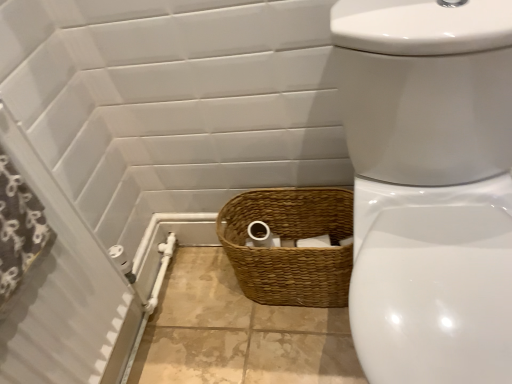
Question: From the image's perspective, is black fabric shower curtain at left on white glossy toilet at center?

Choices:
 (A) yes
 (B) no

Answer: (A)

Question: From a real-world perspective, is black fabric shower curtain at left located beneath white glossy toilet at center?

Choices:
 (A) no
 (B) yes

Answer: (A)

Question: Can white glossy toilet at center be found inside black fabric shower curtain at left?

Choices:
 (A) yes
 (B) no

Answer: (B)

Question: Considering the relative sizes of black fabric shower curtain at left and white glossy toilet at center in the image provided, is black fabric shower curtain at left smaller than white glossy toilet at center?

Choices:
 (A) no
 (B) yes

Answer: (B)

Question: Can you confirm if black fabric shower curtain at left is bigger than white glossy toilet at center?

Choices:
 (A) no
 (B) yes

Answer: (A)

Question: Is black fabric shower curtain at left in front of white glossy toilet at center?

Choices:
 (A) no
 (B) yes

Answer: (A)

Question: From a real-world perspective, is white glossy toilet at center on white textured screen door at left?

Choices:
 (A) no
 (B) yes

Answer: (A)

Question: Is white glossy toilet at center outside white textured screen door at left?

Choices:
 (A) yes
 (B) no

Answer: (A)

Question: Is white glossy toilet at center further to camera compared to white textured screen door at left?

Choices:
 (A) no
 (B) yes

Answer: (A)

Question: From the image's perspective, is white glossy toilet at center below white textured screen door at left?

Choices:
 (A) yes
 (B) no

Answer: (A)

Question: From a real-world perspective, is white glossy toilet at center beneath white textured screen door at left?

Choices:
 (A) no
 (B) yes

Answer: (B)

Question: Can you confirm if white glossy toilet at center is shorter than white textured screen door at left?

Choices:
 (A) no
 (B) yes

Answer: (B)

Question: Does brown woven basket at lower center appear on the left side of white glossy toilet at center?

Choices:
 (A) yes
 (B) no

Answer: (A)